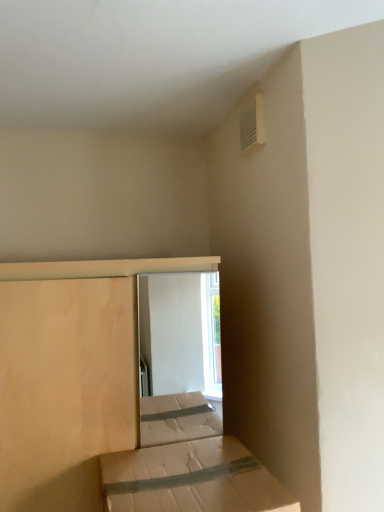
Question: Is brown cardboard box at lower center, marked as the 1th bed in a front-to-back arrangement, at the back of white plastic vent at upper right?

Choices:
 (A) yes
 (B) no

Answer: (B)

Question: Considering the relative positions of white plastic vent at upper right and brown cardboard box at lower center, marked as the second bed in a back-to-front arrangement, in the image provided, is white plastic vent at upper right to the left of brown cardboard box at lower center, marked as the second bed in a back-to-front arrangement, from the viewer's perspective?

Choices:
 (A) yes
 (B) no

Answer: (B)

Question: From the image's perspective, is white plastic vent at upper right over brown cardboard box at lower center, marked as the second bed in a back-to-front arrangement?

Choices:
 (A) no
 (B) yes

Answer: (B)

Question: From a real-world perspective, is white plastic vent at upper right located beneath brown cardboard box at lower center, marked as the second bed in a back-to-front arrangement?

Choices:
 (A) no
 (B) yes

Answer: (A)

Question: Considering the relative sizes of white plastic vent at upper right and brown cardboard box at lower center, marked as the 1th bed in a front-to-back arrangement, in the image provided, is white plastic vent at upper right smaller than brown cardboard box at lower center, marked as the 1th bed in a front-to-back arrangement,?

Choices:
 (A) no
 (B) yes

Answer: (B)

Question: In terms of size, does brown cardboard box at lower center, marked as the second bed in a back-to-front arrangement, appear bigger or smaller than natural wood bed at center, marked as the 1th bed in a back-to-front arrangement?

Choices:
 (A) big
 (B) small

Answer: (B)

Question: From a real-world perspective, is brown cardboard box at lower center, marked as the 1th bed in a front-to-back arrangement, positioned above or below natural wood bed at center, positioned as the 2th bed in front-to-back order?

Choices:
 (A) above
 (B) below

Answer: (B)

Question: From the image's perspective, is brown cardboard box at lower center, marked as the second bed in a back-to-front arrangement, above or below natural wood bed at center, marked as the 1th bed in a back-to-front arrangement?

Choices:
 (A) below
 (B) above

Answer: (A)

Question: Considering the relative positions of brown cardboard box at lower center, marked as the 1th bed in a front-to-back arrangement, and natural wood bed at center, marked as the 1th bed in a back-to-front arrangement, in the image provided, is brown cardboard box at lower center, marked as the 1th bed in a front-to-back arrangement, to the left or to the right of natural wood bed at center, marked as the 1th bed in a back-to-front arrangement,?

Choices:
 (A) right
 (B) left

Answer: (A)

Question: Based on their positions, is natural wood bed at center, positioned as the 2th bed in front-to-back order, located to the left or right of brown cardboard box at lower center, marked as the second bed in a back-to-front arrangement?

Choices:
 (A) right
 (B) left

Answer: (B)

Question: In the image, is natural wood bed at center, positioned as the 2th bed in front-to-back order, positioned in front of or behind brown cardboard box at lower center, marked as the second bed in a back-to-front arrangement?

Choices:
 (A) behind
 (B) front

Answer: (A)

Question: Considering the positions of point (66, 379) and point (220, 479), is point (66, 379) closer or farther from the camera than point (220, 479)?

Choices:
 (A) farther
 (B) closer

Answer: (A)

Question: Choose the correct answer: Is natural wood bed at center, positioned as the 2th bed in front-to-back order, inside brown cardboard box at lower center, marked as the 1th bed in a front-to-back arrangement, or outside it?

Choices:
 (A) inside
 (B) outside

Answer: (B)

Question: From a real-world perspective, is natural wood bed at center, marked as the 1th bed in a back-to-front arrangement, above or below white plastic vent at upper right?

Choices:
 (A) below
 (B) above

Answer: (A)

Question: Is natural wood bed at center, positioned as the 2th bed in front-to-back order, situated inside white plastic vent at upper right or outside?

Choices:
 (A) inside
 (B) outside

Answer: (B)